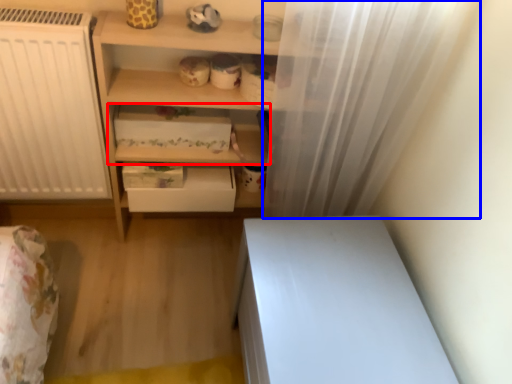
Question: Among these objects, which one is nearest to the camera, shelf (highlighted by a red box) or shower curtain (highlighted by a blue box)?

Choices:
 (A) shelf
 (B) shower curtain

Answer: (B)